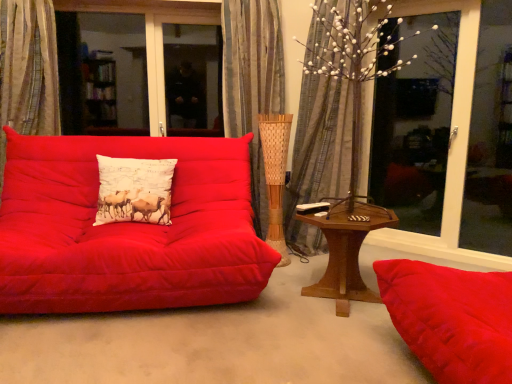
The height and width of the screenshot is (384, 512). Identify the location of space that is in front of wooden hexagonal table at center. (337, 341).